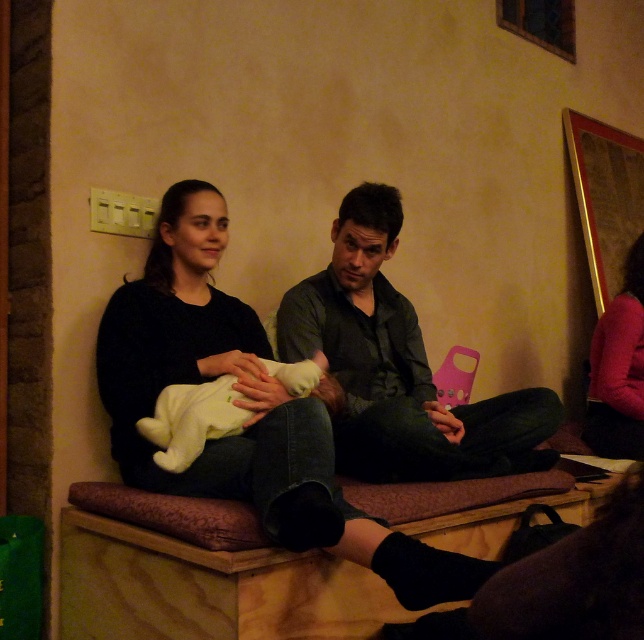
You are a tailor who needs to determine which garment requires more fabric for alterations. Based on the image, which of the two garments, the dark gray shirt at center or the matte pink sweater at right, would need more fabric due to its size?

The dark gray shirt at center is bigger than the matte pink sweater at right, so it would require more fabric for alterations.

You are standing in the room and see two points marked on the floor. The first point is at point (638, 452) and the second is at point (149, 420). If you want to walk from the first point to the second point, which direction should you move relative to the bench?

You should move forward towards the bench because point (638, 452) is behind point (149, 420), meaning the second point is closer to the bench.